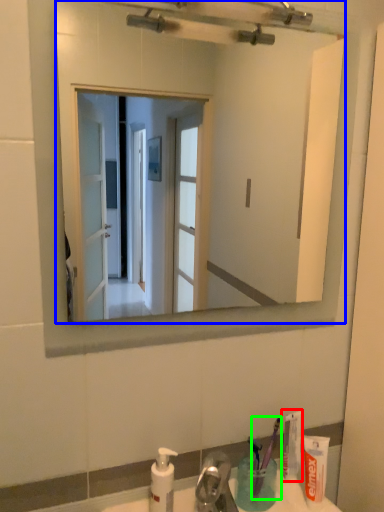
Question: Considering the real-world distances, which object is closest to toothpaste (highlighted by a red box)? mirror (highlighted by a blue box) or toothbrush (highlighted by a green box).

Choices:
 (A) mirror
 (B) toothbrush

Answer: (B)